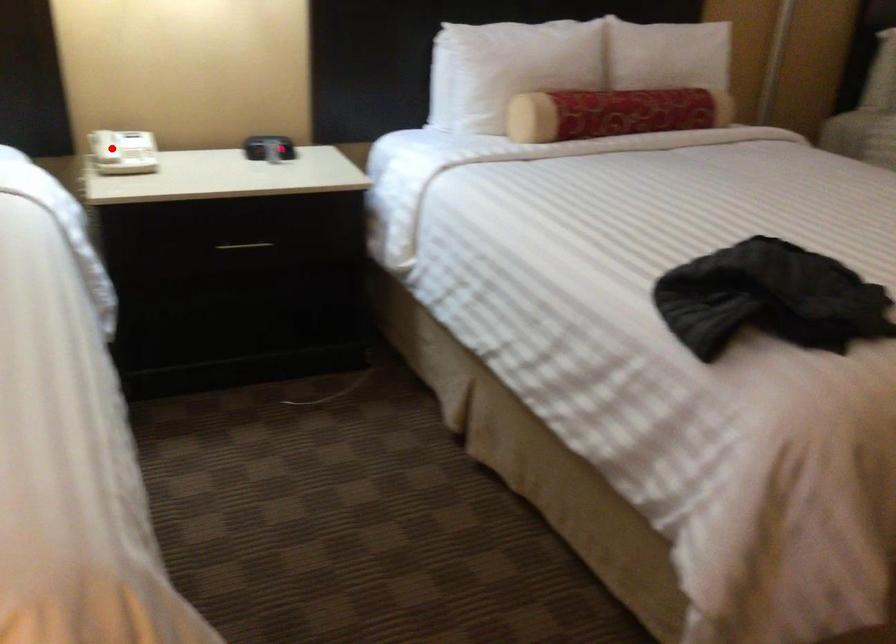
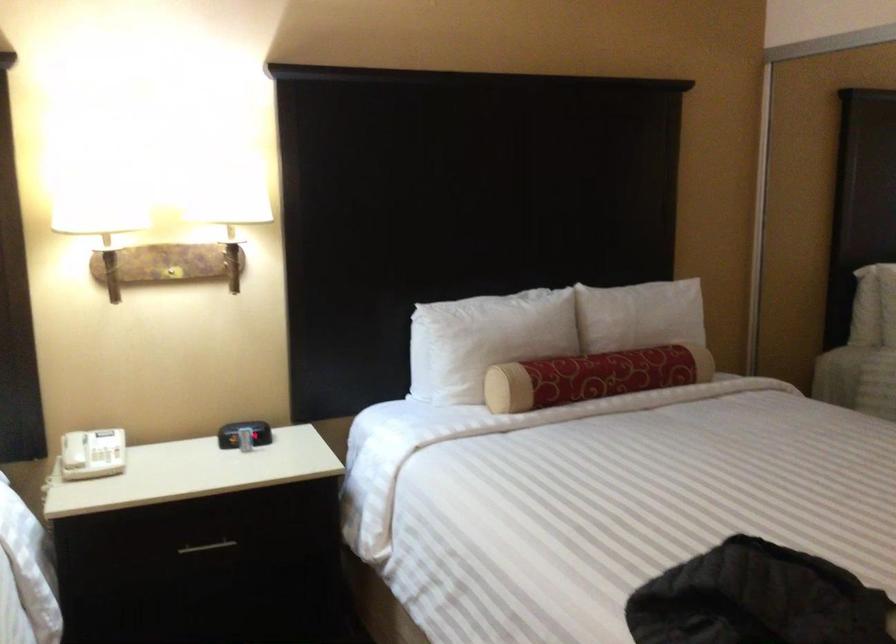
The point at the highlighted location is marked in the first image. Where is the corresponding point in the second image?

(73, 450)